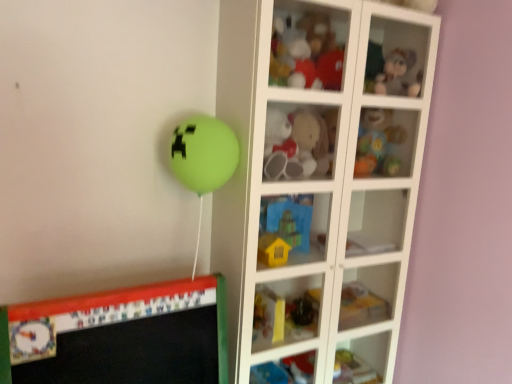
Question: Is point (271, 243) closer or farther from the camera than point (298, 59)?

Choices:
 (A) closer
 (B) farther

Answer: (B)

Question: Is yellow matte house at center, which appears as the 5th toy when viewed from the top, inside or outside of matte plastic teddy bear at upper center, the first toy positioned from the top?

Choices:
 (A) outside
 (B) inside

Answer: (A)

Question: Which object is positioned farthest from the matte plastic cabinet at lower center, the 1th cabinet positioned from the bottom?

Choices:
 (A) white glass cabinet at center
 (B) rubberized plastic toy at lower center, which is counted as the 1th toy, starting from the bottom
 (C) rubberized plastic baby rattle at upper right, which is the second toy in top-to-bottom order
 (D) fuzzy fabric plush toy at upper right, which ranks as the 2th cabinet in bottom-to-top order
 (E) yellow matte house at center, the 2th toy when ordered from bottom to top

Answer: (D)

Question: Based on their relative distances, which object is nearer to the white glass cabinet at center?

Choices:
 (A) rubberized plastic baby rattle at upper right, positioned as the 5th toy in bottom-to-top order
 (B) rubberized plastic toy at lower center, placed as the 6th toy when sorted from top to bottom
 (C) fluffy plush toy at center, placed as the third toy when sorted from top to bottom
 (D) yellow matte house at center, the 2th toy when ordered from bottom to top
 (E) matte plastic cabinet at lower center, the first cabinet positioned from the left

Answer: (C)